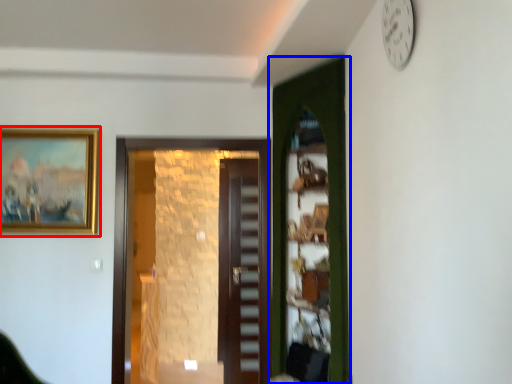
Question: Which of the following is the closest to the observer, picture frame (highlighted by a red box) or door (highlighted by a blue box)?

Choices:
 (A) picture frame
 (B) door

Answer: (B)